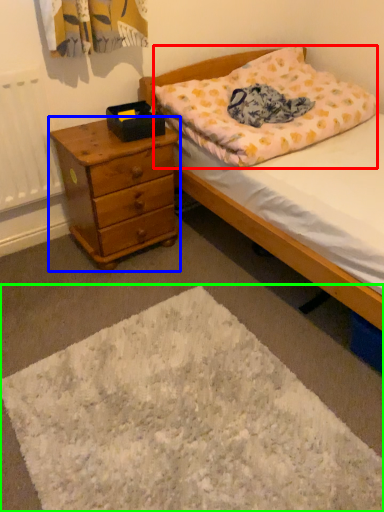
Question: Estimate the real-world distances between objects in this image. Which object is farther from pillow (highlighted by a red box), chest of drawers (highlighted by a blue box) or mat (highlighted by a green box)?

Choices:
 (A) chest of drawers
 (B) mat

Answer: (B)